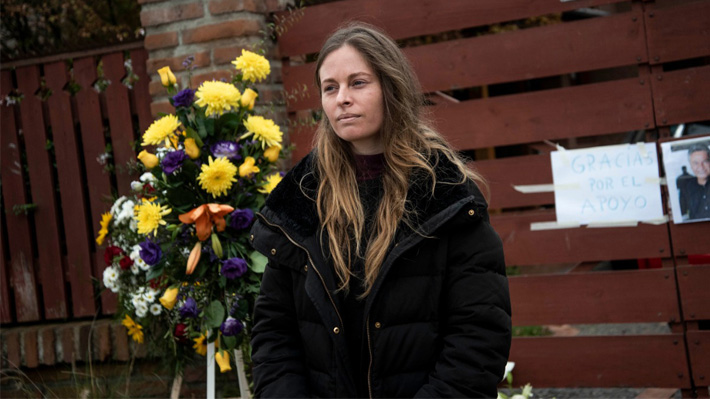
Where is `thank you sign`? The width and height of the screenshot is (710, 399). thank you sign is located at coordinates (606, 176).